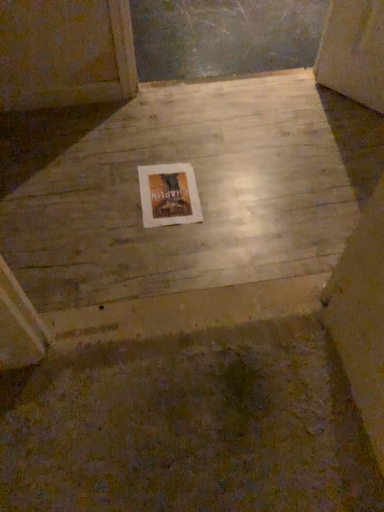
This screenshot has width=384, height=512. What do you see at coordinates (199, 192) in the screenshot?
I see `smooth concrete floor at center` at bounding box center [199, 192].

I want to click on smooth concrete floor at center, so click(x=199, y=192).

This screenshot has height=512, width=384. What do you see at coordinates (169, 195) in the screenshot? I see `white paper at center` at bounding box center [169, 195].

What is the approximate width of white paper at center?

It is 11.98 inches.

Locate an element on the screen. white paper at center is located at coordinates pos(169,195).

Find the location of `smooth concrete floor at center`. smooth concrete floor at center is located at coordinates (199, 192).

In the image, is white paper at center on the left side or the right side of smooth concrete floor at center?

In the image, white paper at center appears on the left side of smooth concrete floor at center.

Is white paper at center further to the viewer compared to smooth concrete floor at center?

Yes.

Is point (164, 180) closer or farther from the camera than point (107, 190)?

Point (164, 180) is farther from the camera than point (107, 190).

From the image's perspective, is white paper at center above or below smooth concrete floor at center?

white paper at center is situated lower than smooth concrete floor at center in the image.

From a real-world perspective, which object rests below the other?

smooth concrete floor at center, from a real-world perspective.

Can you confirm if white paper at center is thinner than smooth concrete floor at center?

Indeed, white paper at center has a lesser width compared to smooth concrete floor at center.

Is white paper at center taller than smooth concrete floor at center?

No.

Who is bigger, white paper at center or smooth concrete floor at center?

Bigger between the two is smooth concrete floor at center.

Is white paper at center inside the boundaries of smooth concrete floor at center, or outside?

The correct answer is: inside.

Is white paper at center not close to smooth concrete floor at center?

white paper at center is near smooth concrete floor at center, not far away.

Is white paper at center turned away from smooth concrete floor at center?

Yes.

How many degrees apart are the facing directions of white paper at center and smooth concrete floor at center?

The facing directions of white paper at center and smooth concrete floor at center are 0.739 degrees apart.

Image resolution: width=384 pixels, height=512 pixels. Identify the location of picture frame above the smooth concrete floor at center (from a real-world perspective). (169, 195).

Is smooth concrete floor at center at the left side of white paper at center?

In fact, smooth concrete floor at center is to the right of white paper at center.

Considering the relative positions of smooth concrete floor at center and white paper at center in the image provided, is smooth concrete floor at center in front of white paper at center?

Yes.

Is point (176, 272) farther from viewer compared to point (147, 178)?

No.

From the image's perspective, is smooth concrete floor at center positioned above or below white paper at center?

smooth concrete floor at center is above white paper at center.

From a real-world perspective, is smooth concrete floor at center positioned above or below white paper at center?

From a real-world perspective, smooth concrete floor at center is physically below white paper at center.

Between smooth concrete floor at center and white paper at center, which one has larger width?

smooth concrete floor at center.

Which of these two, smooth concrete floor at center or white paper at center, stands shorter?

white paper at center is shorter.

Considering the relative sizes of smooth concrete floor at center and white paper at center in the image provided, is smooth concrete floor at center smaller than white paper at center?

No.

Can white paper at center be found inside smooth concrete floor at center?

Yes, white paper at center can be found within smooth concrete floor at center.

Is smooth concrete floor at center next to white paper at center and touching it?

There is a gap between smooth concrete floor at center and white paper at center.

Is smooth concrete floor at center looking in the opposite direction of white paper at center?

That's right, smooth concrete floor at center is facing away from white paper at center.

How many degrees apart are the facing directions of smooth concrete floor at center and white paper at center?

smooth concrete floor at center and white paper at center are facing 0.739 degrees away from each other.

This screenshot has width=384, height=512. Identify the location of concrete that appears above the white paper at center (from the image's perspective). (199, 192).

Locate an element on the screen. concrete above the white paper at center (from the image's perspective) is located at coordinates (199, 192).

Where is `concrete that appears below the white paper at center (from a real-world perspective)`? This screenshot has width=384, height=512. concrete that appears below the white paper at center (from a real-world perspective) is located at coordinates (199, 192).